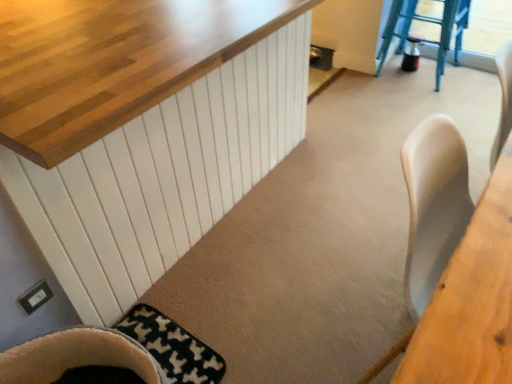
The image size is (512, 384). Describe the element at coordinates (172, 347) in the screenshot. I see `black and white textured mat at lower left` at that location.

Where is `wooden table at right`? The width and height of the screenshot is (512, 384). wooden table at right is located at coordinates (471, 299).

From the image's perspective, is black and white textured mat at lower left below wooden table at right?

Yes, from the image's perspective, black and white textured mat at lower left is below wooden table at right.

Between point (153, 332) and point (448, 322), which one is positioned behind?

The point (153, 332) is farther.

Are black and white textured mat at lower left and wooden table at right beside each other?

No, black and white textured mat at lower left is not next to wooden table at right.

How many degrees apart are the facing directions of blue plastic stool at upper right and soft beige fabric chair at lower left?

1.97 degrees separate the facing orientations of blue plastic stool at upper right and soft beige fabric chair at lower left.

Considering their positions, is blue plastic stool at upper right located in front of or behind soft beige fabric chair at lower left?

blue plastic stool at upper right is behind soft beige fabric chair at lower left.

From a real-world perspective, does blue plastic stool at upper right sit lower than soft beige fabric chair at lower left?

No, from a real-world perspective, blue plastic stool at upper right is not below soft beige fabric chair at lower left.

Can we say blue plastic stool at upper right lies outside soft beige fabric chair at lower left?

blue plastic stool at upper right is positioned outside soft beige fabric chair at lower left.

You are a GUI agent. You are given a task and a screenshot of the screen. Output one action in this format:
    pyautogui.click(x=<x>, y=<y>)
    Task: Click on the table in front of the black and white textured mat at lower left
    The height and width of the screenshot is (384, 512).
    Given the screenshot: What is the action you would take?
    pyautogui.click(x=471, y=299)

Which object is thinner, wooden table at right or black and white textured mat at lower left?

With smaller width is wooden table at right.

Is wooden table at right far from black and white textured mat at lower left?

They are positioned close to each other.

Is blue plastic stool at upper right touching wooden table at right?

No, blue plastic stool at upper right is not in contact with wooden table at right.

Is blue plastic stool at upper right completely or partially outside of wooden table at right?

Yes.

How different are the orientations of blue plastic stool at upper right and wooden table at right in degrees?

176 degrees.

From a real-world perspective, is blue plastic stool at upper right physically above wooden table at right?

Actually, blue plastic stool at upper right is physically below wooden table at right in the real world.

Which is behind, point (436, 378) or point (379, 56)?

The point (379, 56) is more distant.

Is blue plastic stool at upper right surrounded by wooden table at right?

No, wooden table at right does not contain blue plastic stool at upper right.

Which is more to the right, wooden table at right or blue plastic stool at upper right?

→ From the viewer's perspective, blue plastic stool at upper right appears more on the right side.

From the picture: Are wooden table at right and blue plastic stool at upper right far apart?

Indeed, wooden table at right is not near blue plastic stool at upper right.

Find the location of a particular element. Image resolution: width=512 pixels, height=384 pixels. table that is on the right side of soft beige fabric chair at lower left is located at coordinates (471, 299).

From the picture: Is wooden table at right inside soft beige fabric chair at lower left?

Definitely not — wooden table at right is not inside soft beige fabric chair at lower left.

Is soft beige fabric chair at lower left taller than wooden table at right?

Incorrect, the height of soft beige fabric chair at lower left is not larger of that of wooden table at right.

Who is taller, soft beige fabric chair at lower left or black and white textured mat at lower left?

soft beige fabric chair at lower left.

Looking at this image, is soft beige fabric chair at lower left positioned beyond the bounds of black and white textured mat at lower left?

Yes, soft beige fabric chair at lower left is located beyond the bounds of black and white textured mat at lower left.

Which object is positioned more to the left, soft beige fabric chair at lower left or black and white textured mat at lower left?

From the viewer's perspective, soft beige fabric chair at lower left appears more on the left side.

This screenshot has height=384, width=512. What are the coordinates of `mat beneath the soft beige fabric chair at lower left (from a real-world perspective)` in the screenshot? It's located at (172, 347).

This screenshot has width=512, height=384. I want to click on table in front of the black and white textured mat at lower left, so click(x=471, y=299).

The height and width of the screenshot is (384, 512). Identify the location of step stool located above the soft beige fabric chair at lower left (from a real-world perspective). (429, 22).

When comparing their distances from soft beige fabric chair at lower left, does blue plastic stool at upper right or wooden table at right seem closer?

The object closer to soft beige fabric chair at lower left is wooden table at right.

Based on their spatial positions, is soft beige fabric chair at lower left or wooden table at right closer to black and white textured mat at lower left?

Based on the image, soft beige fabric chair at lower left appears to be nearer to black and white textured mat at lower left.

When comparing their distances from black and white textured mat at lower left, does blue plastic stool at upper right or soft beige fabric chair at lower left seem closer?

soft beige fabric chair at lower left is closer to black and white textured mat at lower left.

From the image, which object appears to be nearer to blue plastic stool at upper right, soft beige fabric chair at lower left or black and white textured mat at lower left?

black and white textured mat at lower left lies closer to blue plastic stool at upper right than the other object.

From the image, which object appears to be farther from black and white textured mat at lower left, wooden table at right or blue plastic stool at upper right?

blue plastic stool at upper right is further to black and white textured mat at lower left.

Based on their spatial positions, is blue plastic stool at upper right or wooden table at right closer to black and white textured mat at lower left?

Based on the image, wooden table at right appears to be nearer to black and white textured mat at lower left.

Considering their positions, is soft beige fabric chair at lower left positioned further to blue plastic stool at upper right than wooden table at right?

→ soft beige fabric chair at lower left is positioned further to the anchor blue plastic stool at upper right.

From the picture: Considering their positions, is wooden table at right positioned closer to blue plastic stool at upper right than soft beige fabric chair at lower left?

wooden table at right.

Identify the location of mat between soft beige fabric chair at lower left and wooden table at right from left to right. The image size is (512, 384). (172, 347).

The image size is (512, 384). Identify the location of table between blue plastic stool at upper right and black and white textured mat at lower left in the up-down direction. (471, 299).

The width and height of the screenshot is (512, 384). I want to click on mat that lies between blue plastic stool at upper right and soft beige fabric chair at lower left from top to bottom, so click(x=172, y=347).

Where is `table between blue plastic stool at upper right and soft beige fabric chair at lower left in the up-down direction`? Image resolution: width=512 pixels, height=384 pixels. table between blue plastic stool at upper right and soft beige fabric chair at lower left in the up-down direction is located at coordinates (471, 299).